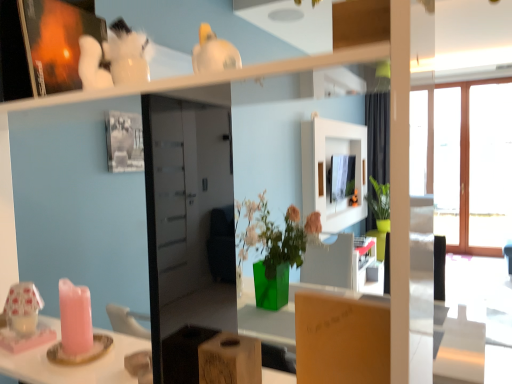
Measure the distance between point (463, 114) and camera.

They are 5.56 meters apart.

What is the approximate width of matte brown cardboard box at center, the first cardboard box from the right?

The width of matte brown cardboard box at center, the first cardboard box from the right, is 1.32 inches.

This screenshot has width=512, height=384. I want to click on wooden block at center, which is the second cardboard box in right-to-left order, so click(x=230, y=360).

From the picture: How much space does wooden block at center, which is the second cardboard box in right-to-left order, occupy vertically?

wooden block at center, which is the second cardboard box in right-to-left order, is 3.86 inches in height.

Locate an element on the screen. The height and width of the screenshot is (384, 512). wooden frame at right is located at coordinates (489, 168).

From a real-world perspective, which is physically below, wooden block at center, which is the second cardboard box in right-to-left order, or wooden frame at right?

From a 3D spatial view, wooden block at center, which is the second cardboard box in right-to-left order, is below.

Is wooden block at center, which is the second cardboard box in right-to-left order, inside the boundaries of wooden frame at right, or outside?

wooden block at center, which is the second cardboard box in right-to-left order, exists outside the volume of wooden frame at right.

From the image's perspective, which one is positioned lower, wooden frame at right or wooden block at center, which is the second cardboard box in right-to-left order?

wooden block at center, which is the second cardboard box in right-to-left order, is shown below in the image.

Does wooden frame at right have a lesser width compared to wooden block at center, which is the second cardboard box in right-to-left order?

Yes.

Measure the distance from wooden frame at right to wooden block at center, which is the second cardboard box in right-to-left order.

They are 18.13 feet apart.

Does wooden frame at right appear on the right side of wooden block at center, which is the second cardboard box in right-to-left order?

Yes, wooden frame at right is to the right of wooden block at center, which is the second cardboard box in right-to-left order.

From a real-world perspective, who is located higher, matte brown cardboard box at center, the second cardboard box viewed from the left, or wooden frame at right?

wooden frame at right.

Does matte brown cardboard box at center, the second cardboard box viewed from the left, have a larger size compared to wooden frame at right?

Actually, matte brown cardboard box at center, the second cardboard box viewed from the left, might be smaller than wooden frame at right.

Is the depth of matte brown cardboard box at center, the first cardboard box from the right, less than that of wooden frame at right?

Yes.

Could you tell me if matte brown cardboard box at center, the first cardboard box from the right, is turned towards wooden frame at right?

Yes, matte brown cardboard box at center, the first cardboard box from the right, is aimed at wooden frame at right.

What's the angular difference between matte brown cardboard box at center, the first cardboard box from the right, and wooden block at center, the first cardboard box from the left,'s facing directions?

1.72 degrees separate the facing orientations of matte brown cardboard box at center, the first cardboard box from the right, and wooden block at center, the first cardboard box from the left.

Could you tell me if matte brown cardboard box at center, the first cardboard box from the right, is facing wooden block at center, which is the second cardboard box in right-to-left order?

No, matte brown cardboard box at center, the first cardboard box from the right, is not oriented towards wooden block at center, which is the second cardboard box in right-to-left order.

Are matte brown cardboard box at center, the second cardboard box viewed from the left, and wooden block at center, which is the second cardboard box in right-to-left order, far apart?

They are positioned close to each other.

From a real-world perspective, is matte brown cardboard box at center, the first cardboard box from the right, on wooden block at center, the first cardboard box from the left?

Yes, from a real-world perspective, matte brown cardboard box at center, the first cardboard box from the right, is on top of wooden block at center, the first cardboard box from the left.

Is wooden block at center, which is the second cardboard box in right-to-left order, looking in the opposite direction of matte brown cardboard box at center, the second cardboard box viewed from the left?

No.

Which point is more distant from viewer, (238, 345) or (300, 364)?

Point (238, 345)

Can you confirm if wooden block at center, which is the second cardboard box in right-to-left order, is smaller than matte brown cardboard box at center, the first cardboard box from the right?

Yes.

Consider the image. Do you think wooden block at center, the first cardboard box from the left, is within matte brown cardboard box at center, the first cardboard box from the right, or outside of it?

wooden block at center, the first cardboard box from the left, is not inside matte brown cardboard box at center, the first cardboard box from the right, it's outside.

From the image's perspective, is wooden frame at right above matte brown cardboard box at center, the first cardboard box from the right?

Correct, wooden frame at right appears higher than matte brown cardboard box at center, the first cardboard box from the right, in the image.

Considering the relative sizes of wooden frame at right and matte brown cardboard box at center, the first cardboard box from the right, in the image provided, is wooden frame at right bigger than matte brown cardboard box at center, the first cardboard box from the right,?

Yes.

Considering their positions, is wooden frame at right located in front of or behind matte brown cardboard box at center, the first cardboard box from the right?

In the image, wooden frame at right appears behind matte brown cardboard box at center, the first cardboard box from the right.

Is wooden frame at right in contact with matte brown cardboard box at center, the first cardboard box from the right?

No, wooden frame at right is not next to matte brown cardboard box at center, the first cardboard box from the right.

I want to click on window located on the right of wooden block at center, the first cardboard box from the left, so click(489, 168).

Identify the location of window above the wooden block at center, the first cardboard box from the left (from a real-world perspective). This screenshot has width=512, height=384. (489, 168).

From the image, which object appears to be farther from wooden block at center, the first cardboard box from the left, matte brown cardboard box at center, the first cardboard box from the right, or wooden frame at right?

wooden frame at right is further to wooden block at center, the first cardboard box from the left.

Which object lies nearer to the anchor point wooden frame at right, matte brown cardboard box at center, the second cardboard box viewed from the left, or wooden block at center, which is the second cardboard box in right-to-left order?

Based on the image, matte brown cardboard box at center, the second cardboard box viewed from the left, appears to be nearer to wooden frame at right.

Looking at the image, which one is located closer to wooden block at center, which is the second cardboard box in right-to-left order, wooden frame at right or matte brown cardboard box at center, the second cardboard box viewed from the left?

The object closer to wooden block at center, which is the second cardboard box in right-to-left order, is matte brown cardboard box at center, the second cardboard box viewed from the left.

From the image, which object appears to be nearer to wooden frame at right, wooden block at center, which is the second cardboard box in right-to-left order, or matte brown cardboard box at center, the first cardboard box from the right?

matte brown cardboard box at center, the first cardboard box from the right.

When comparing their distances from matte brown cardboard box at center, the first cardboard box from the right, does wooden frame at right or wooden block at center, the first cardboard box from the left, seem further?

The object further to matte brown cardboard box at center, the first cardboard box from the right, is wooden frame at right.

Considering their positions, is wooden block at center, the first cardboard box from the left, positioned closer to matte brown cardboard box at center, the first cardboard box from the right, than wooden frame at right?

The object closer to matte brown cardboard box at center, the first cardboard box from the right, is wooden block at center, the first cardboard box from the left.

The width and height of the screenshot is (512, 384). I want to click on cardboard box between matte brown cardboard box at center, the second cardboard box viewed from the left, and wooden frame at right in the front-back direction, so click(230, 360).